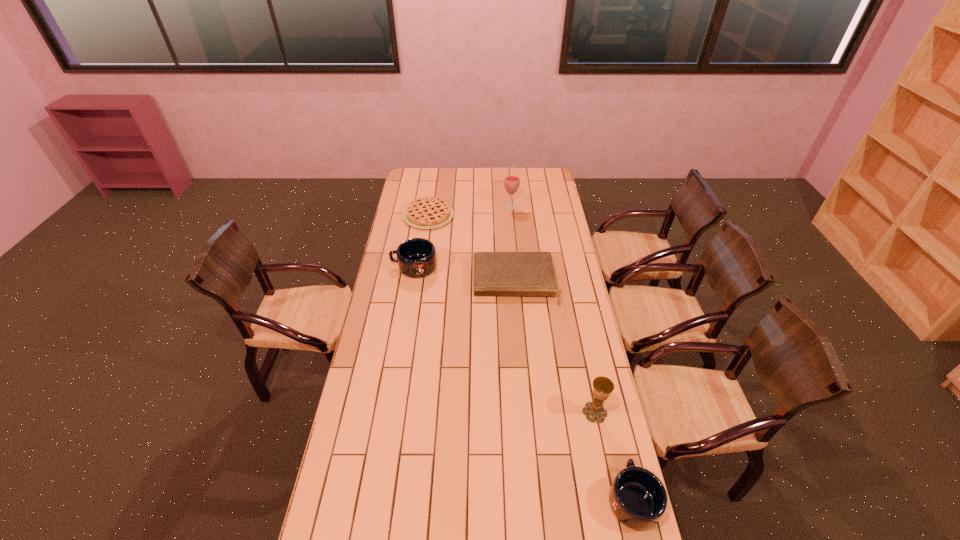
Find the location of a particular element. The height and width of the screenshot is (540, 960). free space that is in between the taller mug and the fifth farthest object is located at coordinates (504, 340).

Find the location of a particular element. The height and width of the screenshot is (540, 960). free space between the fifth farthest object and the farther mug is located at coordinates (504, 340).

What are the coordinates of `empty space between the paperback book and the nearer mug` in the screenshot? It's located at (574, 392).

This screenshot has height=540, width=960. Find the location of `vacant point located between the paperback book and the shortest object`. vacant point located between the paperback book and the shortest object is located at coordinates (472, 250).

Identify the location of free space between the shortest object and the nearer mug. Image resolution: width=960 pixels, height=540 pixels. (531, 357).

Select which object is the closest to the nearest object. Please provide its 2D coordinates. Your answer should be formatted as a tuple, i.e. [(x, y)], where the tuple contains the x and y coordinates of a point satisfying the conditions above.

[(602, 386)]

Where is `object that is the second closest one to the right mug`? object that is the second closest one to the right mug is located at coordinates (494, 273).

What are the coordinates of `free space that satisfies the following two spatial constraints: 1. with the handle on the side of the left mug; 2. with the handle on the side of the nearer mug` in the screenshot? It's located at 376,498.

Find the location of `free location that satisfies the following two spatial constraints: 1. on the front side of the shortest object; 2. with the handle on the side of the taller mug`. free location that satisfies the following two spatial constraints: 1. on the front side of the shortest object; 2. with the handle on the side of the taller mug is located at coordinates (421, 267).

Where is `vacant position in the image that satisfies the following two spatial constraints: 1. on the spine side of the paperback book; 2. on the right side of the chalice`? The image size is (960, 540). vacant position in the image that satisfies the following two spatial constraints: 1. on the spine side of the paperback book; 2. on the right side of the chalice is located at coordinates (526, 413).